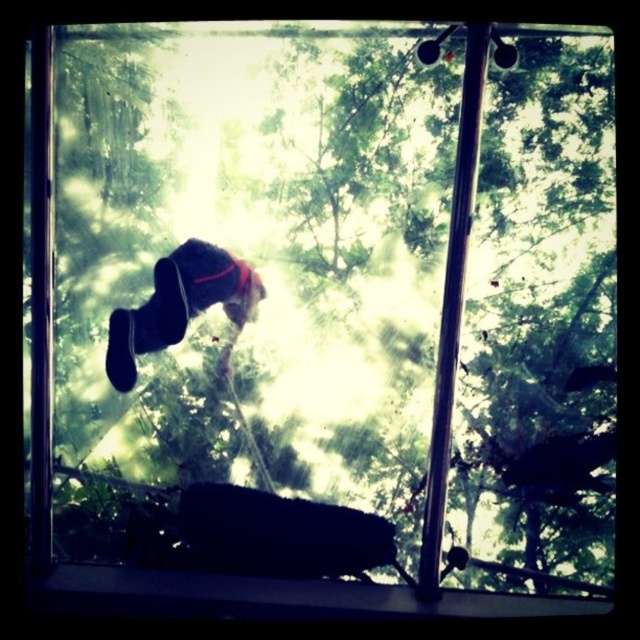
You are a photographer holding a camera at the position of the camera in the scene. You want to take a photo of the black plastic window sill at lower center. Can you reach it without moving your feet?

The black plastic window sill at lower center and camera are 1.37 meters apart. Since the distance is within a typical arm reach, you can likely reach the black plastic window sill at lower center without moving your feet.

You are standing inside the room looking through the window. There are two points marked on the window pane at coordinates point (600, 611) and point (132, 368). Which point is closer to you, the observer?

Point (600, 611) is in front of point (132, 368), so it is closer to you.

You are trying to determine if the black suede shoes at center can be placed on the black plastic window sill at lower center. Based on their heights, can the shoes be placed on the window sill without any issues?

The black plastic window sill at lower center has a lesser height compared to black suede shoes at center. Therefore, the shoes cannot be placed on the window sill because the sill is shorter than the shoes in height.